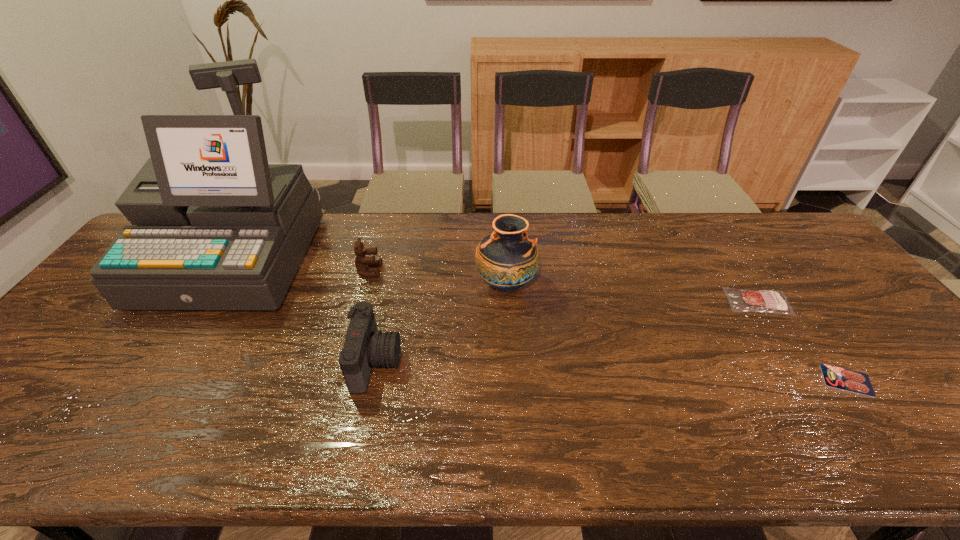
Where is `object that is the second closest to the second tallest object`? Image resolution: width=960 pixels, height=540 pixels. object that is the second closest to the second tallest object is located at coordinates (362, 262).

Where is `the second closest object to the teddy bear`? The height and width of the screenshot is (540, 960). the second closest object to the teddy bear is located at coordinates (365, 347).

Image resolution: width=960 pixels, height=540 pixels. What are the coordinates of `blank area in the image that satisfies the following two spatial constraints: 1. on the face of the teddy bear; 2. on the right side of the pottery` in the screenshot? It's located at (366, 285).

Find the location of `vacant area that satisfies the following two spatial constraints: 1. on the front side of the second shortest object; 2. on the left side of the shortest object`. vacant area that satisfies the following two spatial constraints: 1. on the front side of the second shortest object; 2. on the left side of the shortest object is located at coordinates (809, 380).

The width and height of the screenshot is (960, 540). I want to click on vacant space that satisfies the following two spatial constraints: 1. on the face of the teddy bear; 2. on the back side of the shortest object, so [x=339, y=380].

At what (x,y) coordinates should I click in order to perform the action: click on vacant position in the image that satisfies the following two spatial constraints: 1. on the front side of the fourth object from left to right; 2. on the left side of the steak. Please return your answer as a coordinate pair (x, y). The image size is (960, 540). Looking at the image, I should click on (507, 302).

The image size is (960, 540). I want to click on vacant position in the image that satisfies the following two spatial constraints: 1. on the front side of the third object from right to left; 2. on the right side of the salami, so click(512, 380).

Locate an element on the screen. This screenshot has height=540, width=960. free space that satisfies the following two spatial constraints: 1. on the customer-facing side of the tallest object; 2. on the left side of the shortest object is located at coordinates (156, 380).

The height and width of the screenshot is (540, 960). Identify the location of blank area in the image that satisfies the following two spatial constraints: 1. on the back side of the steak; 2. on the face of the teddy bear. (737, 271).

At what (x,y) coordinates should I click in order to perform the action: click on free space in the image that satisfies the following two spatial constraints: 1. on the customer-facing side of the fourth object from left to right; 2. on the right side of the tallest object. Please return your answer as a coordinate pair (x, y). This screenshot has height=540, width=960. Looking at the image, I should click on (217, 285).